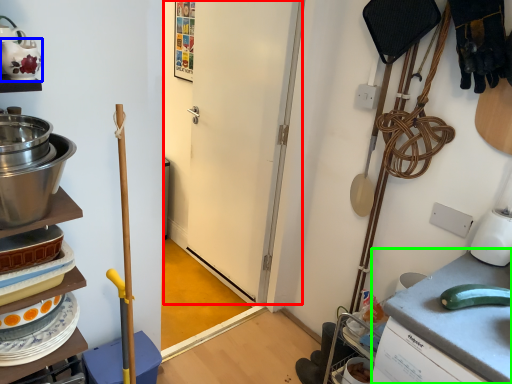
Question: Considering the real-world distances, which object is farthest from door (highlighted by a red box)? tea pot (highlighted by a blue box) or counter top (highlighted by a green box)?

Choices:
 (A) tea pot
 (B) counter top

Answer: (A)